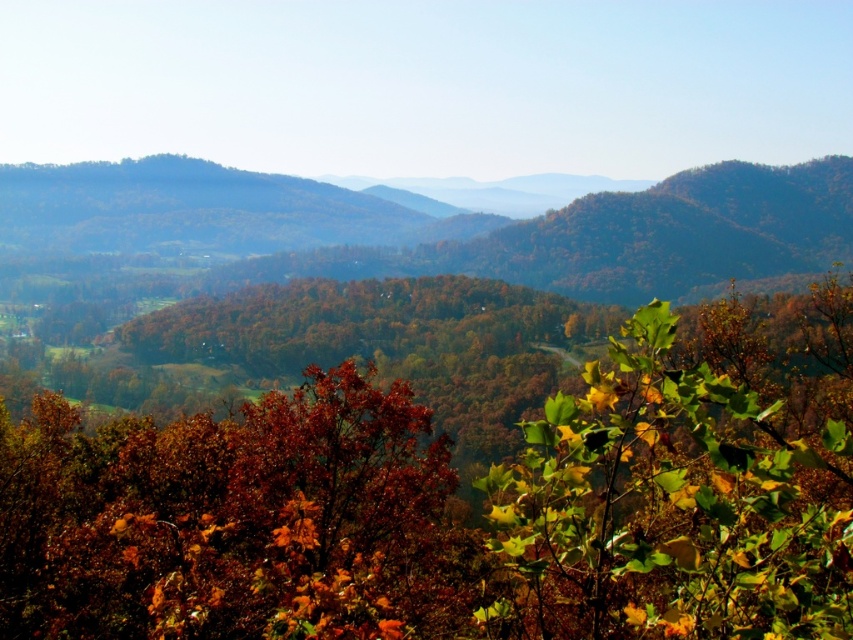
Question: Which point is farther to the camera?

Choices:
 (A) (815, 376)
 (B) (657, 516)

Answer: (A)

Question: Can you confirm if autumn leaves at center is positioned above green leafy bush at center?

Choices:
 (A) no
 (B) yes

Answer: (A)

Question: Is the position of autumn leaves at center more distant than that of green leafy bush at center?

Choices:
 (A) yes
 (B) no

Answer: (A)

Question: Can you confirm if autumn leaves at center is smaller than green leafy bush at center?

Choices:
 (A) no
 (B) yes

Answer: (A)

Question: Which point is closer to the camera?

Choices:
 (A) green leafy bush at center
 (B) autumn leaves at center

Answer: (A)